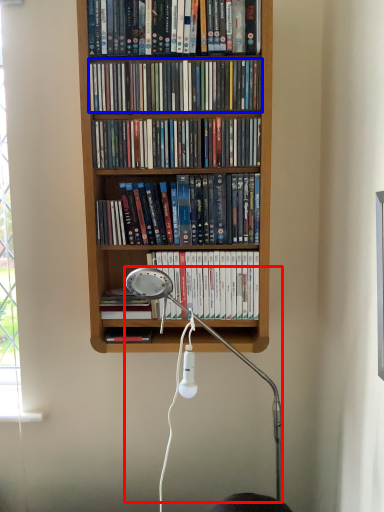
Question: Among these objects, which one is farthest to the camera, lamp (highlighted by a red box) or book (highlighted by a blue box)?

Choices:
 (A) lamp
 (B) book

Answer: (B)